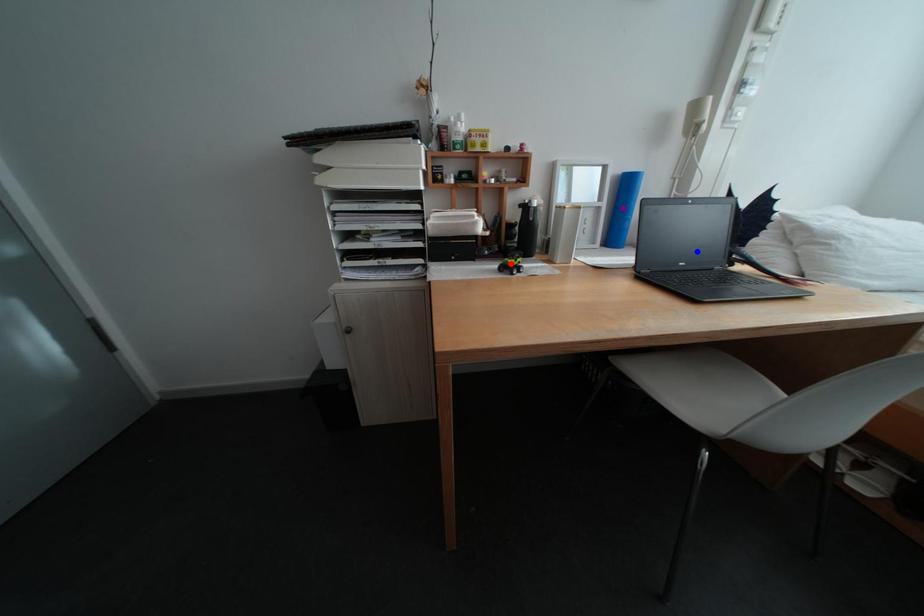
Order these from nearest to farthest:
blue point, red point, purple point

purple point
red point
blue point